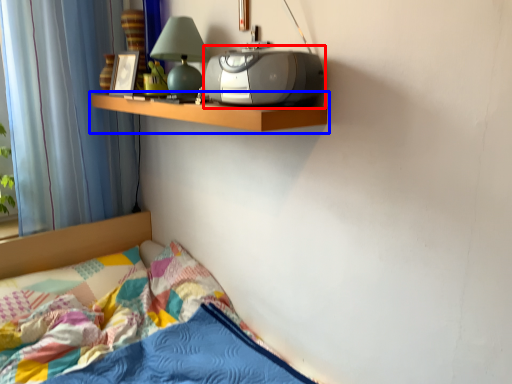
Question: Which of the following is the farthest to the observer, stereo (highlighted by a red box) or shelf (highlighted by a blue box)?

Choices:
 (A) stereo
 (B) shelf

Answer: (B)